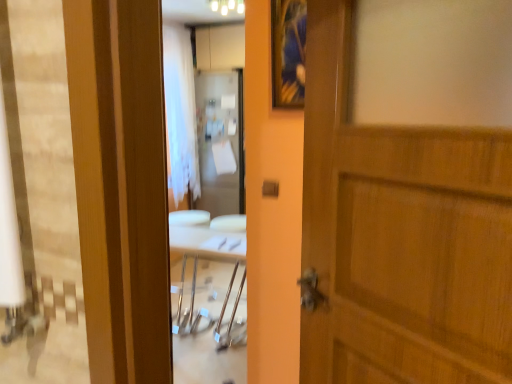
Question: Would you say wooden framed picture at upper center is inside or outside white sheer curtain at center?

Choices:
 (A) outside
 (B) inside

Answer: (A)

Question: From their relative heights in the image, would you say wooden framed picture at upper center is taller or shorter than white sheer curtain at center?

Choices:
 (A) short
 (B) tall

Answer: (A)

Question: Estimate the real-world distances between objects in this image. Which object is farther from the wooden door at center?

Choices:
 (A) white glossy light fixture at upper center
 (B) wooden framed picture at upper center
 (C) white sheer curtain at center

Answer: (C)

Question: Which object is the closest to the wooden door at center?

Choices:
 (A) wooden framed picture at upper center
 (B) white sheer curtain at center
 (C) white glossy light fixture at upper center

Answer: (A)